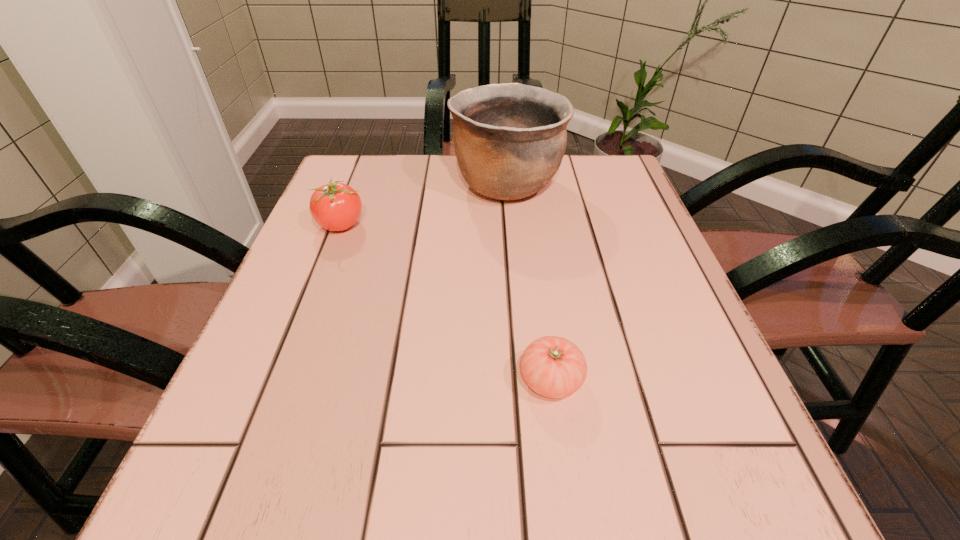
Image resolution: width=960 pixels, height=540 pixels. Identify the location of free space at the far edge. (410, 155).

Locate an element on the screen. vacant space at the near edge is located at coordinates (420, 469).

You are a GUI agent. You are given a task and a screenshot of the screen. Output one action in this format:
    pyautogui.click(x=<x>, y=<y>)
    Task: Click on the free region at the left edge
    
    Given the screenshot: What is the action you would take?
    pyautogui.click(x=373, y=240)

Find the location of a particular element. free space at the right edge is located at coordinates (672, 398).

Find the location of a particular element. free space at the far right corner of the desktop is located at coordinates (575, 159).

The image size is (960, 540). What are the coordinates of `free space at the near right corner` in the screenshot? It's located at (708, 522).

This screenshot has width=960, height=540. Find the location of `vacant area between the pottery and the farther tomato`. vacant area between the pottery and the farther tomato is located at coordinates (424, 205).

This screenshot has height=540, width=960. I want to click on empty space that is in between the leftmost object and the pottery, so click(424, 205).

Identify the location of free space between the pottery and the leftmost object. (424, 205).

Identify the location of free space between the right tomato and the second tallest object. (446, 302).